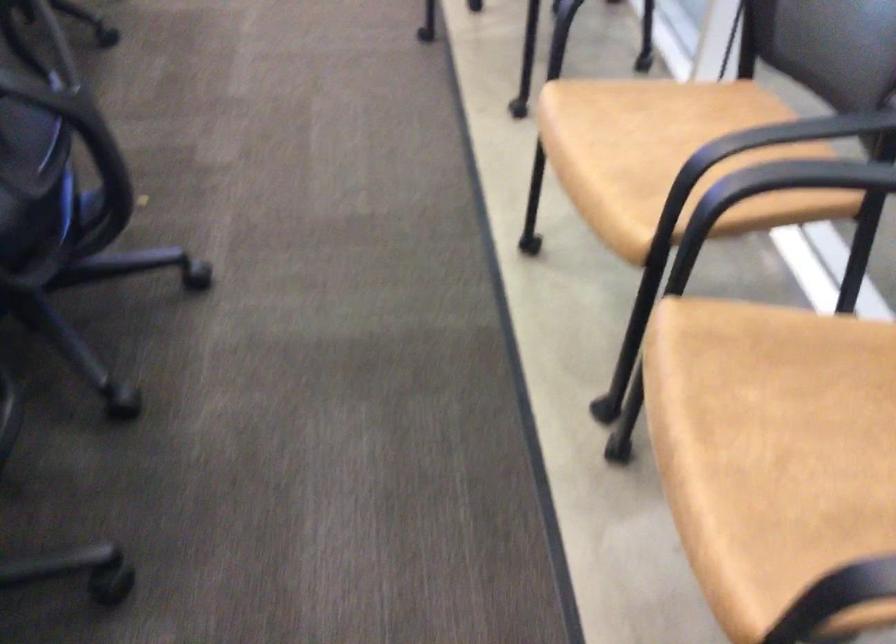
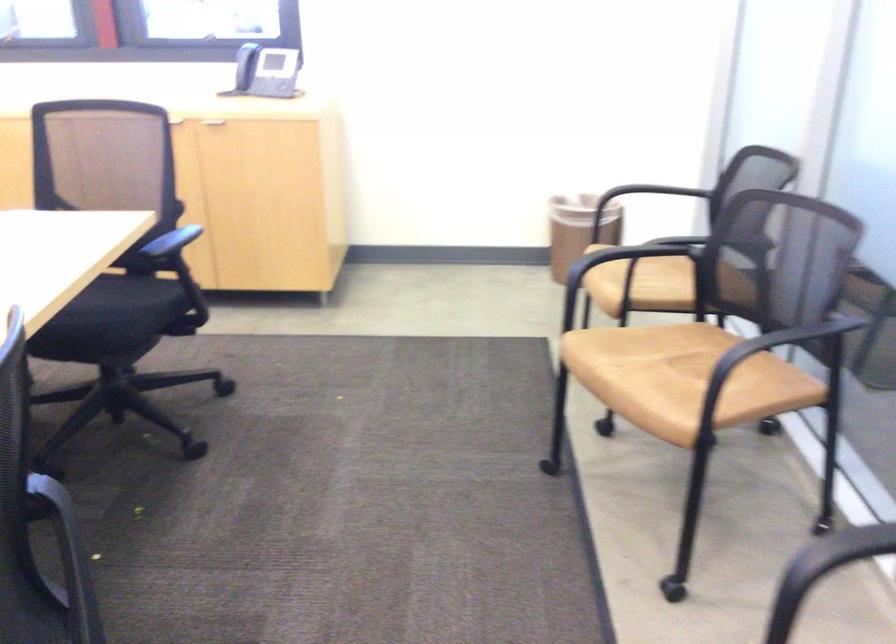
Question: What movement of the cameraman would produce the second image?

Choices:
 (A) Left
 (B) Right
 (C) Forward
 (D) Backward

Answer: (C)